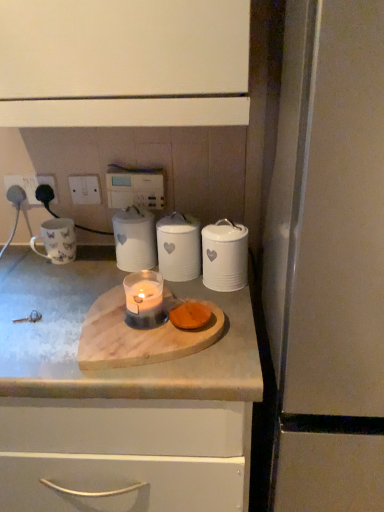
Identify the location of free location to the left of matte white mug at left. The width and height of the screenshot is (384, 512). (22, 264).